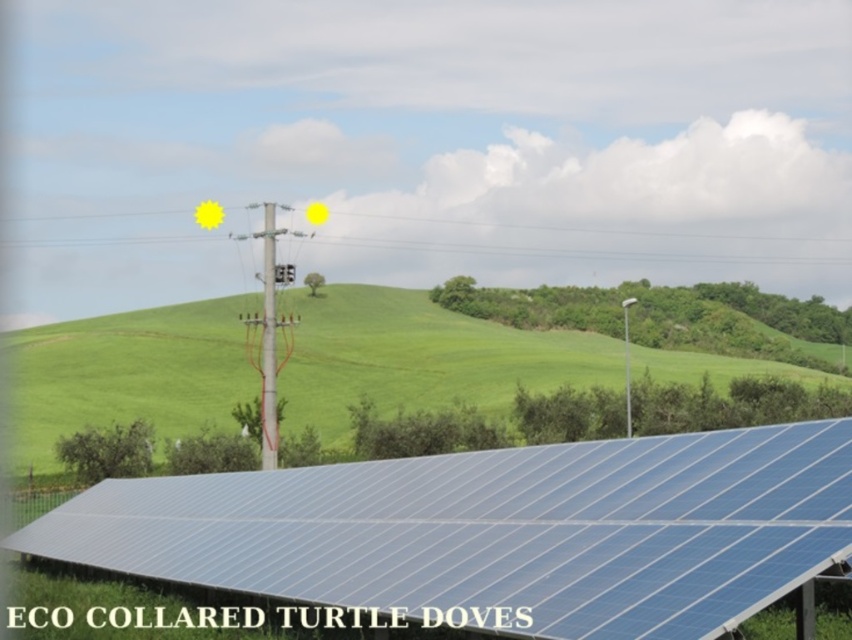
You are standing at the point marked by the coordinates point [498,529] in the image. Looking around, you see the blue solar panel at lower center. What object is directly in front of you?

The point [498,529] marks the blue solar panel at lower center, so the object directly in front of you is the blue solar panel at lower center.

You are standing at the origin point of the coordinate system, which is at the bottom left corner of the image. The utility pole in the mid ground is at position 0.6, 0.6. You want to walk to the utility pole. Is the blue solar panel at lower center in your path?

The blue solar panel at lower center is at position (498,529). The utility pole is at (510,384). Since the solar panel is to the right and slightly below the utility pole, it would be off the direct path from the origin to the utility pole. Therefore, the blue solar panel at lower center is not in your path.

You are planning to install a new solar panel system. You have two options for placement based on the image. The first option is to place it where the blue solar panel at lower center is currently located, and the second option is on the green grassy hillside at center. Considering the width of the available spaces, which location would allow for a wider array of panels?

The green grassy hillside at center is wider than the blue solar panel at lower center, so placing the solar panel array there would allow for a wider installation.